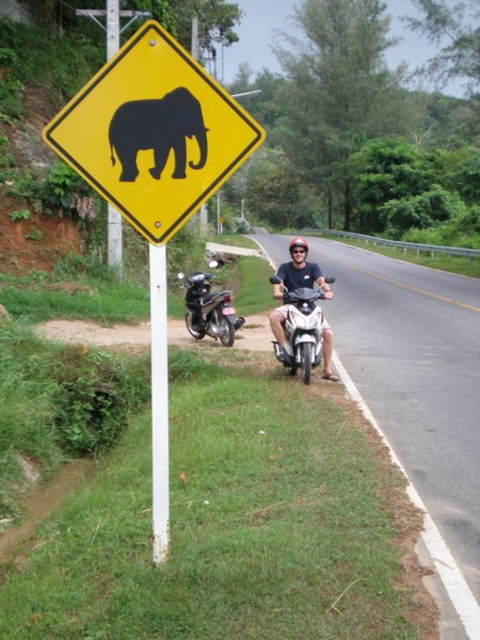
Question: From the image, what is the correct spatial relationship of yellow plastic elephant at upper left in relation to white metal pole at center?

Choices:
 (A) right
 (B) left

Answer: (A)

Question: Which object is positioned closest to the metallic silver scooter at lower left?

Choices:
 (A) yellow plastic elephant at upper left
 (B) asphalt road at center
 (C) yellow plastic diamond-shaped sign with elephant silhouette at left
 (D) white metal pole at center

Answer: (B)

Question: Considering the real-world distances, which object is farthest from the silver metallic scooter at center?

Choices:
 (A) yellow plastic elephant at upper left
 (B) asphalt road at center
 (C) black matte elephant at upper left

Answer: (C)

Question: Does yellow plastic diamond-shaped sign with elephant silhouette at left come behind black matte elephant at upper left?

Choices:
 (A) no
 (B) yes

Answer: (A)

Question: Which object is the farthest from the metallic silver scooter at lower left?

Choices:
 (A) yellow plastic elephant at upper left
 (B) asphalt road at center
 (C) yellow plastic diamond-shaped sign with elephant silhouette at left
 (D) white metal pole at center

Answer: (D)

Question: Is yellow plastic diamond-shaped sign with elephant silhouette at left in front of yellow plastic elephant at upper left?

Choices:
 (A) yes
 (B) no

Answer: (B)